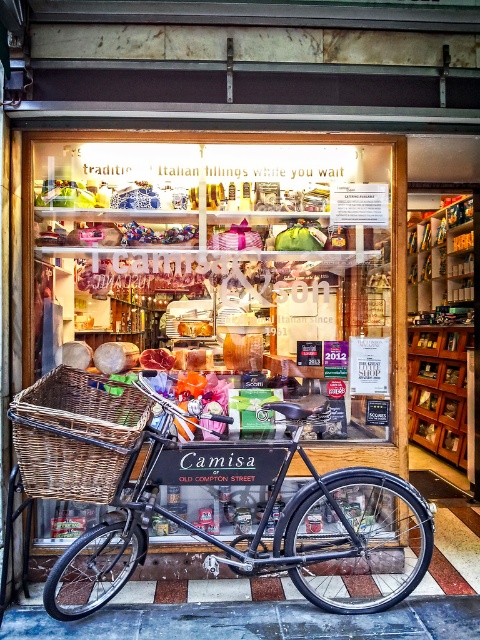
Question: Which object is closer to the camera taking this photo?

Choices:
 (A) woven brown basket at center
 (B) matte black bicycle at center

Answer: (A)

Question: Can you confirm if wooden crate at center is wider than woven brown basket at center?

Choices:
 (A) yes
 (B) no

Answer: (A)

Question: Which point is closer to the camera?

Choices:
 (A) wooden crate at center
 (B) matte black bicycle at center
 (C) woven brown basket at center

Answer: (C)

Question: Can you confirm if matte black bicycle at center is bigger than woven brown basket at center?

Choices:
 (A) no
 (B) yes

Answer: (B)

Question: Which point is closer to the camera?

Choices:
 (A) (120, 403)
 (B) (201, 262)

Answer: (A)

Question: Can you confirm if matte black bicycle at center is bigger than woven brown basket at center?

Choices:
 (A) no
 (B) yes

Answer: (B)